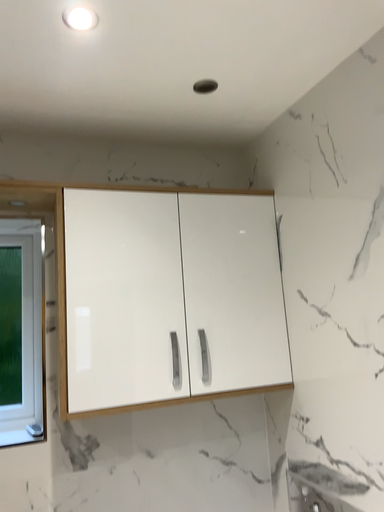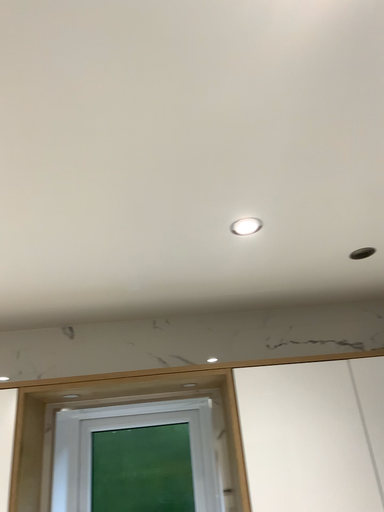
Question: How did the camera likely rotate when shooting the video?

Choices:
 (A) rotated downward
 (B) rotated upward

Answer: (B)